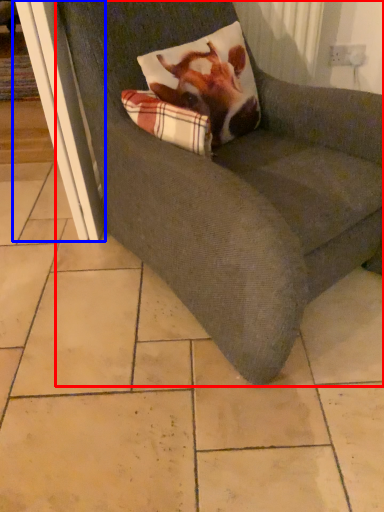
Question: Which of the following is the closest to the observer, chair (highlighted by a red box) or screen door (highlighted by a blue box)?

Choices:
 (A) chair
 (B) screen door

Answer: (A)